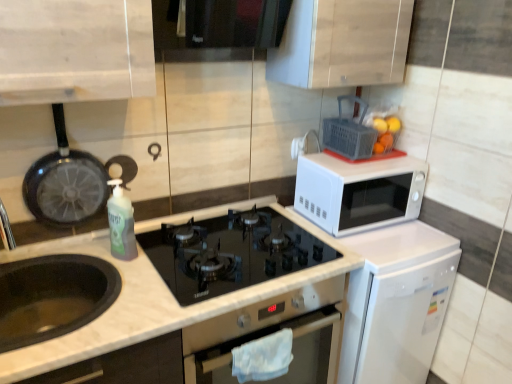
The height and width of the screenshot is (384, 512). In order to click on free location to the right of translucent plastic basket at upper right in this screenshot , I will do `click(394, 157)`.